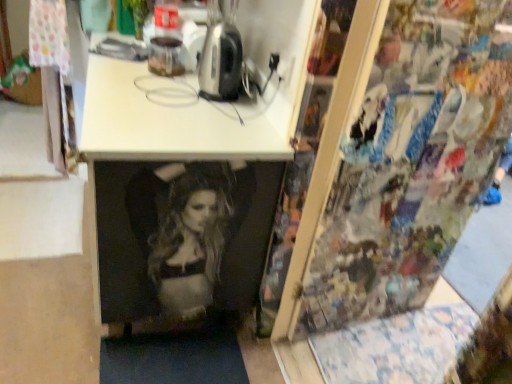
Question: Based on their positions, is metallic silver toaster at upper center located to the left or right of white plastic iron at upper center?

Choices:
 (A) left
 (B) right

Answer: (B)

Question: Looking at the image, does metallic silver toaster at upper center seem bigger or smaller compared to white plastic iron at upper center?

Choices:
 (A) big
 (B) small

Answer: (B)

Question: From the image's perspective, relative to white plastic iron at upper center, is metallic silver toaster at upper center above or below?

Choices:
 (A) below
 (B) above

Answer: (B)

Question: Choose the correct answer: Is white plastic iron at upper center inside metallic silver toaster at upper center or outside it?

Choices:
 (A) outside
 (B) inside

Answer: (A)

Question: From a real-world perspective, is white plastic iron at upper center physically located above or below metallic silver toaster at upper center?

Choices:
 (A) below
 (B) above

Answer: (A)

Question: Is white plastic iron at upper center in front of or behind metallic silver toaster at upper center in the image?

Choices:
 (A) behind
 (B) front

Answer: (B)

Question: Considering the positions of white plastic iron at upper center and metallic silver toaster at upper center in the image, is white plastic iron at upper center taller or shorter than metallic silver toaster at upper center?

Choices:
 (A) tall
 (B) short

Answer: (B)